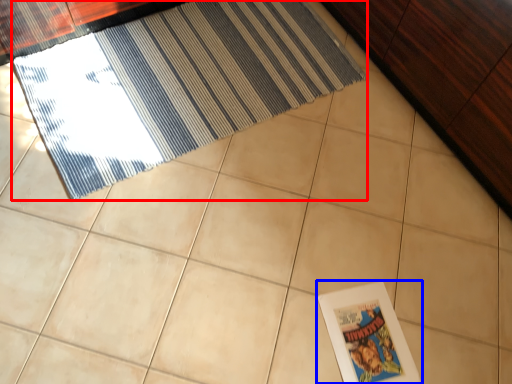
Question: Which point is closer to the camera, door (highlighted by a red box) or picture frame (highlighted by a blue box)?

Choices:
 (A) door
 (B) picture frame

Answer: (B)